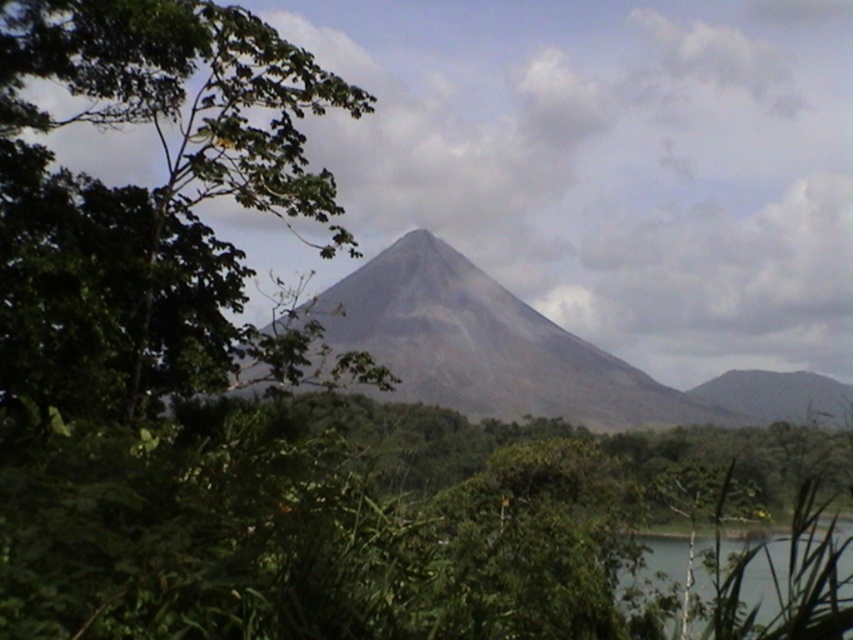
You are a hiker standing at the base of the volcano and want to take a photo of the transparent water at lower right. However, you notice that the green leafy tree at center is blocking your view. Can you determine if the tree is closer to you than the water?

The green leafy tree at center is further to the viewer than transparent water at lower right, meaning the tree is actually behind the water and not blocking it. Therefore, you can take the photo without obstruction.

You are a hiker planning to take a photo of the gray volcanic rock mountain at center. There is a green leafy tree at center blocking your view. Can you estimate whether the tree is wider or narrower than the mountain?

The green leafy tree at center is narrower than the gray volcanic rock mountain at center because its width is less than the mountain.